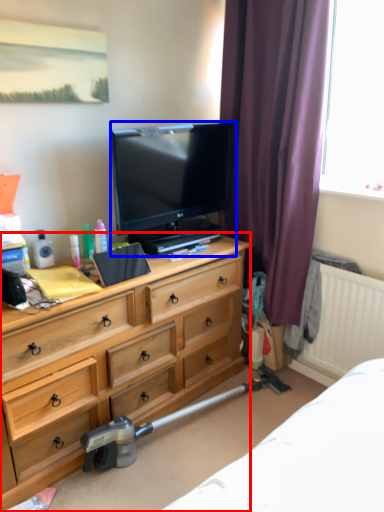
Question: Which object appears closest to the camera in this image, chest of drawers (highlighted by a red box) or television (highlighted by a blue box)?

Choices:
 (A) chest of drawers
 (B) television

Answer: (A)